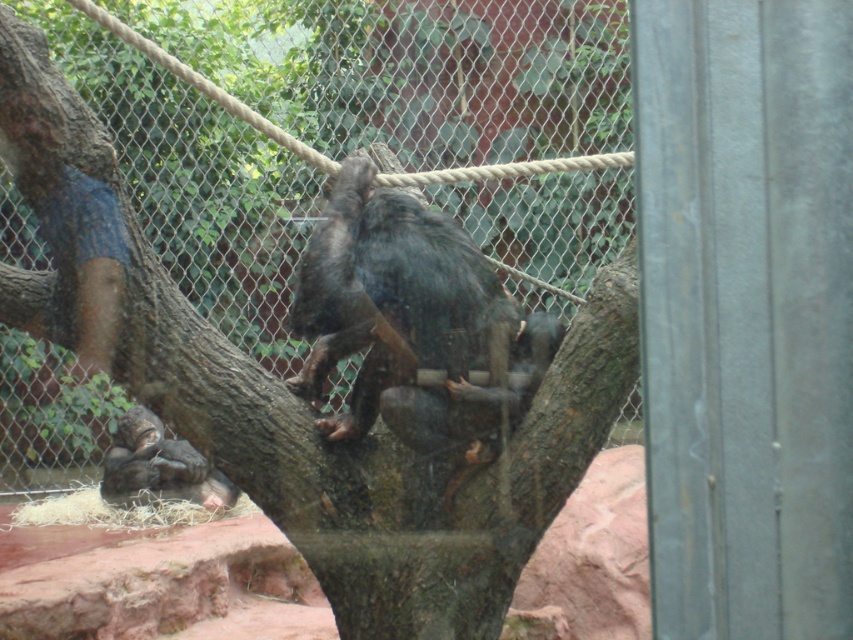
Question: Does shiny black monkey at center have a greater width compared to dark gray fur monkey at lower left?

Choices:
 (A) no
 (B) yes

Answer: (B)

Question: Which point appears farthest from the camera in this image?

Choices:
 (A) (202, 481)
 (B) (357, 308)

Answer: (A)

Question: From the image, what is the correct spatial relationship of shiny black monkey at center in relation to dark gray fur monkey at lower left?

Choices:
 (A) below
 (B) above

Answer: (B)

Question: Can you confirm if shiny black monkey at center is positioned below dark gray fur monkey at lower left?

Choices:
 (A) no
 (B) yes

Answer: (A)